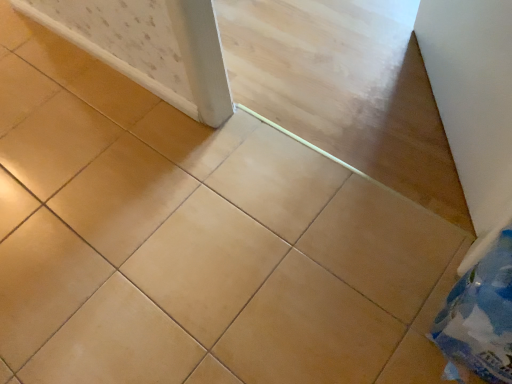
The height and width of the screenshot is (384, 512). I want to click on blue plastic bag at lower right, so click(x=480, y=318).

Describe the element at coordinates (480, 318) in the screenshot. I see `blue plastic bag at lower right` at that location.

Find the location of a particular element. blue plastic bag at lower right is located at coordinates (480, 318).